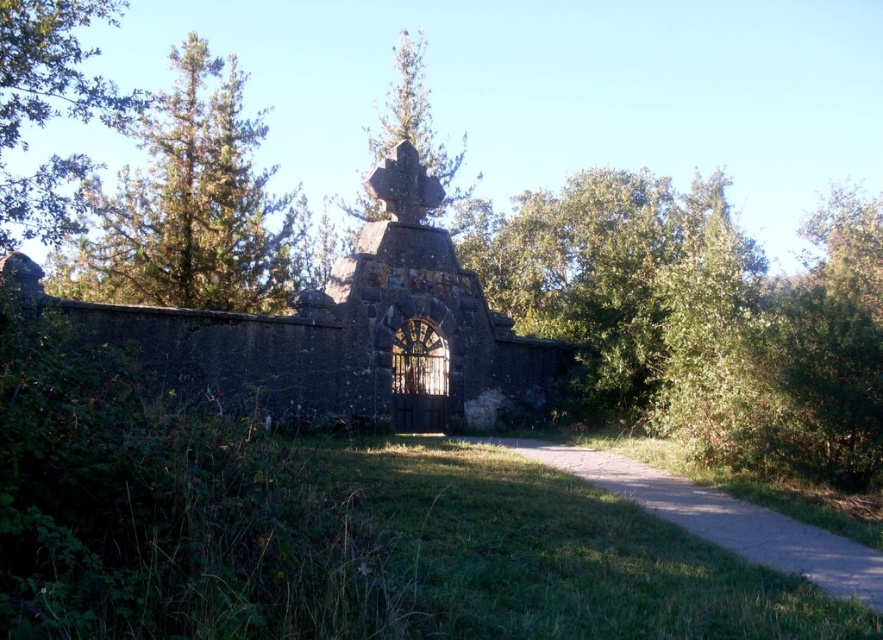
Question: Which point is farther to the camera?

Choices:
 (A) (612, 458)
 (B) (77, 198)

Answer: (B)

Question: Which object appears closest to the camera in this image?

Choices:
 (A) dark stone church at center
 (B) green leafy tree at upper right
 (C) gravel path at lower right
 (D) green textured pine at upper left

Answer: (C)

Question: Which object is farther from the camera taking this photo?

Choices:
 (A) green leafy tree at upper left
 (B) green textured pine at upper left

Answer: (B)

Question: Is green leafy tree at upper right above gravel path at lower right?

Choices:
 (A) yes
 (B) no

Answer: (A)

Question: Can you confirm if green leafy tree at upper right is positioned to the right of green leafy tree at upper left?

Choices:
 (A) no
 (B) yes

Answer: (B)

Question: Is green leafy tree at upper right wider than green leafy tree at upper left?

Choices:
 (A) no
 (B) yes

Answer: (A)